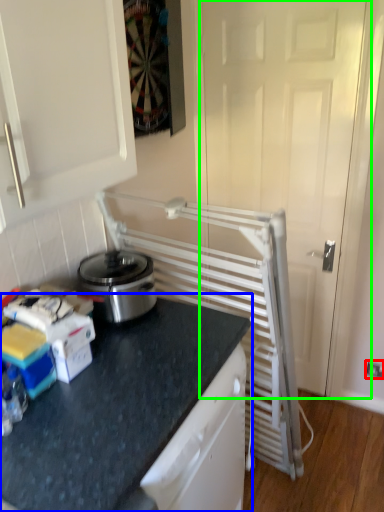
Question: Estimate the real-world distances between objects in this image. Which object is closer to electric outlet (highlighted by a red box), countertop (highlighted by a blue box) or screen door (highlighted by a green box)?

Choices:
 (A) countertop
 (B) screen door

Answer: (B)